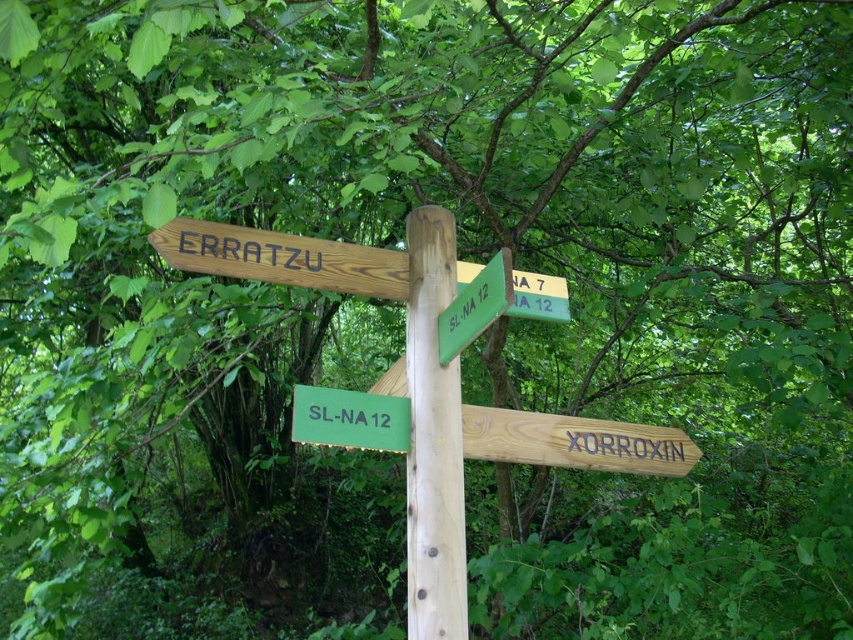
You are standing in the forest and see the wooden signpost at center and the wooden signpost at upper center. Which one is positioned to the right of the other?

The wooden signpost at center is to the right of the wooden signpost at upper center.

You are standing in front of the wooden signpost at center and the wooden signpost at upper center. Which one is closer to you?

The wooden signpost at center is closer to you because it is further to the viewer than the wooden signpost at upper center.